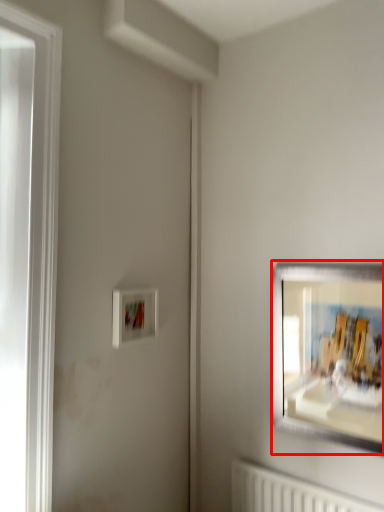
Question: From the image's perspective, where is picture frame (annotated by the red box) located relative to picture frame?

Choices:
 (A) below
 (B) above

Answer: (A)